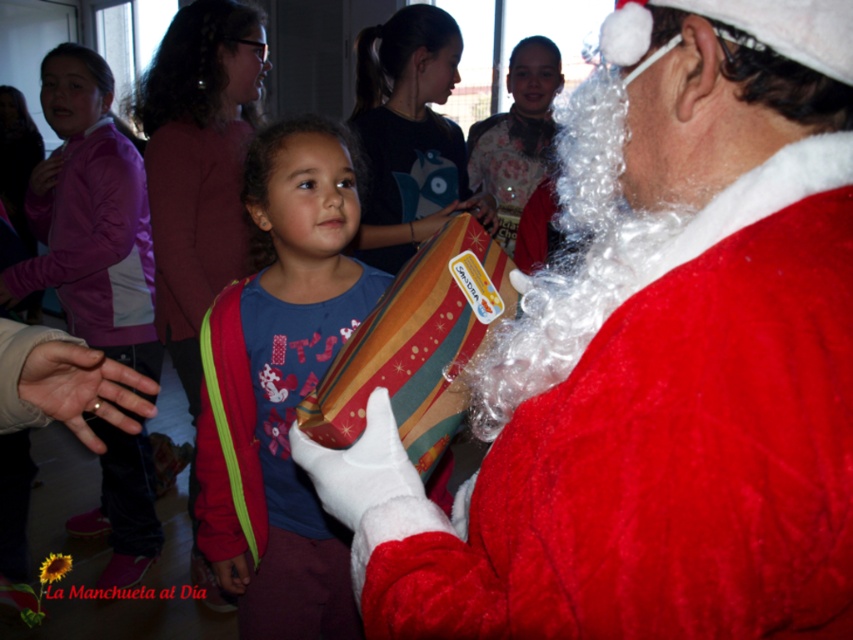
Looking at this image, you are a photographer standing in the scene. You want to take a photo of the purple fleece jacket at left without moving any objects. Can you position yourself close enough to capture the jacket clearly in your shot?

The distance between the purple fleece jacket at left and the viewer is 2.21 meters, so yes, you can position yourself close enough to capture the jacket clearly in your shot since 2.21 meters is a reasonable distance for photography.

You are a photographer at this event. You want to take a photo of the striped fabric gift at center without the purple fleece jacket at left blocking it. Which direction should you move to ensure the gift is fully visible?

The striped fabric gift at center is behind the purple fleece jacket at left, so moving to the right side would position the photographer so the gift is in front of the jacket and fully visible.